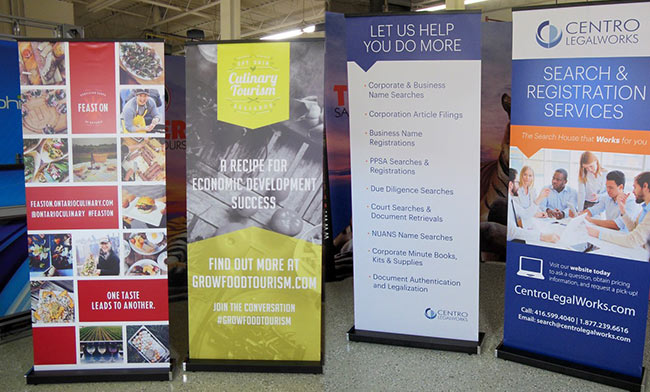
I want to click on posters, so click(x=8, y=218), click(x=86, y=215), click(x=176, y=148), click(x=254, y=152), click(x=335, y=148), click(x=407, y=157), click(x=489, y=113), click(x=554, y=142).